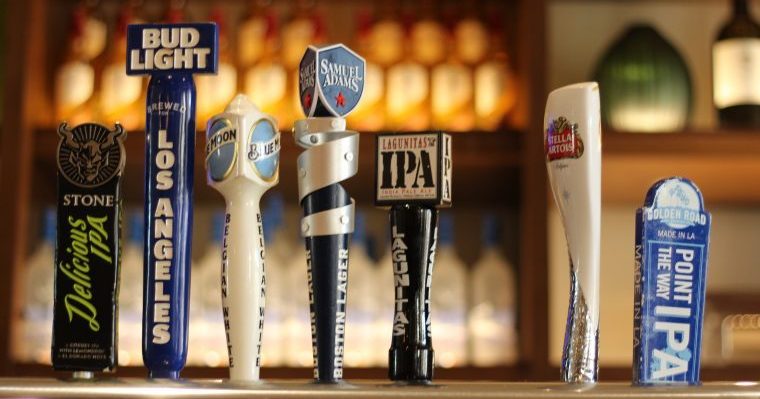
Locate an element on the screen. The height and width of the screenshot is (399, 760). beer tap is located at coordinates (80, 244), (165, 237), (242, 251), (328, 253), (419, 244), (575, 213), (663, 272).